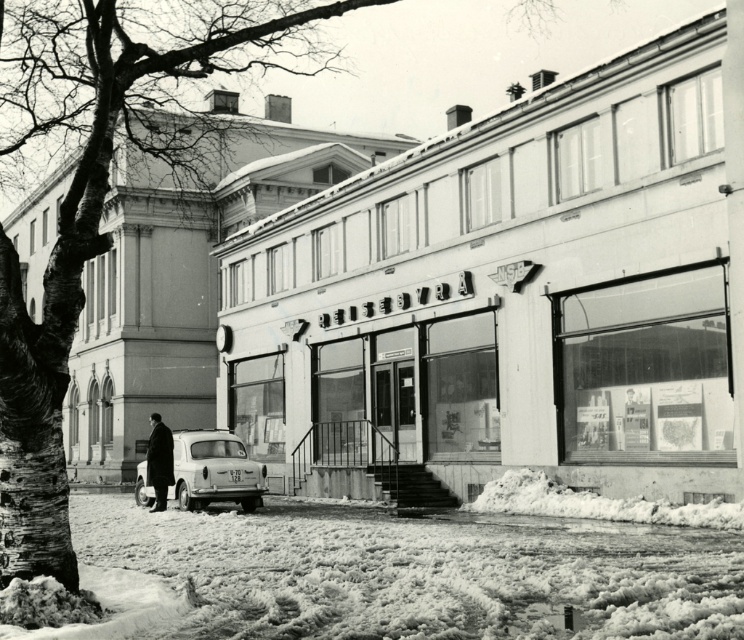
Question: Among these objects, which one is nearest to the camera?

Choices:
 (A) white matte car at lower center
 (B) dark wool coat at center

Answer: (B)

Question: Which object appears closest to the camera in this image?

Choices:
 (A) white matte car at lower center
 (B) dark wool coat at center
 (C) white wood storefront at center

Answer: (C)

Question: Where is white matte car at lower center located in relation to dark wool coat at center in the image?

Choices:
 (A) left
 (B) right

Answer: (A)

Question: Is white wood storefront at center smaller than white matte car at lower center?

Choices:
 (A) yes
 (B) no

Answer: (B)

Question: Estimate the real-world distances between objects in this image. Which object is closer to the white matte car at lower center?

Choices:
 (A) dark wool coat at center
 (B) white wood storefront at center

Answer: (A)

Question: Observing the image, what is the correct spatial positioning of white wood storefront at center in reference to dark wool coat at center?

Choices:
 (A) left
 (B) right

Answer: (B)